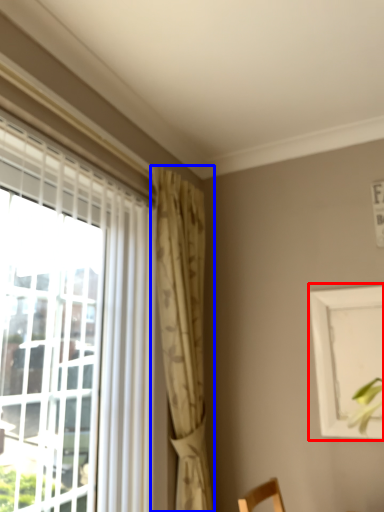
Question: Which object is closer to the camera taking this photo, picture frame (highlighted by a red box) or curtain (highlighted by a blue box)?

Choices:
 (A) picture frame
 (B) curtain

Answer: (B)